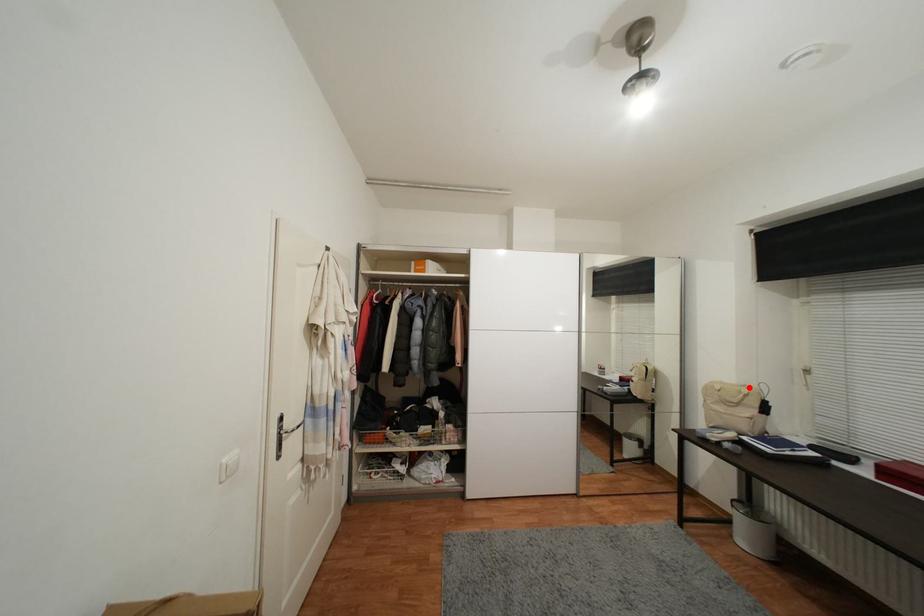
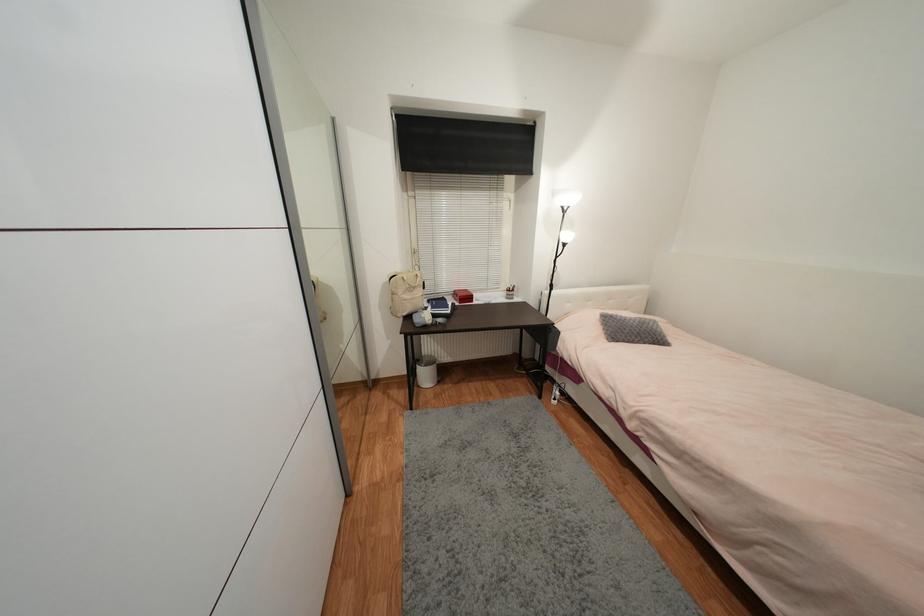
Locate, in the second image, the point that corresponds to the highlighted location in the first image.

(412, 273)